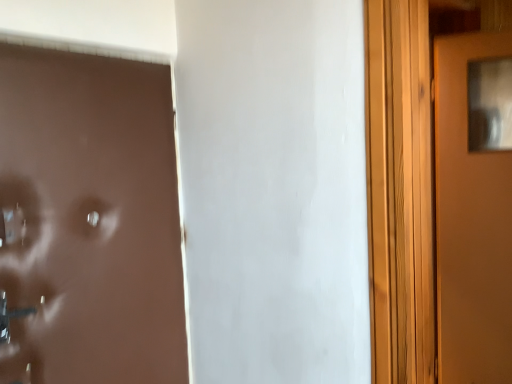
Describe the element at coordinates (471, 222) in the screenshot. The height and width of the screenshot is (384, 512). I see `brown matte door at right, the 2th door viewed from the left` at that location.

Where is `brown matte door at right, the first door when ordered from back to front`? This screenshot has width=512, height=384. brown matte door at right, the first door when ordered from back to front is located at coordinates (471, 222).

This screenshot has height=384, width=512. I want to click on brown matte door at left, the 2th door viewed from the right, so click(90, 220).

Describe the element at coordinates (90, 220) in the screenshot. This screenshot has width=512, height=384. I see `brown matte door at left, the 1th door in the left-to-right sequence` at that location.

Image resolution: width=512 pixels, height=384 pixels. What are the coordinates of `brown matte door at right, the first door when ordered from back to front` in the screenshot? It's located at (471, 222).

Is brown matte door at right, the first door when ordered from back to front, at the right side of brown matte door at left, positioned as the first door in front-to-back order?

Correct, you'll find brown matte door at right, the first door when ordered from back to front, to the right of brown matte door at left, positioned as the first door in front-to-back order.

Is the position of brown matte door at right, the first door when ordered from back to front, less distant than that of brown matte door at left, the 2th door viewed from the right?

That is False.

Is point (506, 208) positioned before point (127, 295)?

No, it is behind (127, 295).

From the image's perspective, is brown matte door at right, the first door when ordered from back to front, positioned above or below brown matte door at left, positioned as the first door in front-to-back order?

brown matte door at right, the first door when ordered from back to front, is above brown matte door at left, positioned as the first door in front-to-back order.

From a real-world perspective, is brown matte door at right, the 2th door viewed from the left, on brown matte door at left, the second door when ordered from back to front?

No, from a real-world perspective, brown matte door at right, the 2th door viewed from the left, is not on top of brown matte door at left, the second door when ordered from back to front.

Is brown matte door at right, the 2th door viewed from the left, wider than brown matte door at left, the 1th door in the left-to-right sequence?

Correct, the width of brown matte door at right, the 2th door viewed from the left, exceeds that of brown matte door at left, the 1th door in the left-to-right sequence.

Is brown matte door at right, the 2th door viewed from the left, taller or shorter than brown matte door at left, positioned as the first door in front-to-back order?

brown matte door at right, the 2th door viewed from the left, is taller than brown matte door at left, positioned as the first door in front-to-back order.

Between brown matte door at right, marked as the 2th door in a front-to-back arrangement, and brown matte door at left, the 1th door in the left-to-right sequence, which one has larger size?

brown matte door at left, the 1th door in the left-to-right sequence.

Which is correct: brown matte door at right, marked as the 2th door in a front-to-back arrangement, is inside brown matte door at left, the second door when ordered from back to front, or outside of it?

brown matte door at right, marked as the 2th door in a front-to-back arrangement, lies outside brown matte door at left, the second door when ordered from back to front.

Is brown matte door at right, which is counted as the first door, starting from the right, not close to brown matte door at left, positioned as the first door in front-to-back order?

Absolutely, brown matte door at right, which is counted as the first door, starting from the right, is distant from brown matte door at left, positioned as the first door in front-to-back order.

Is brown matte door at right, the 2th door viewed from the left, aimed at brown matte door at left, the 1th door in the left-to-right sequence?

No, brown matte door at right, the 2th door viewed from the left, is not turned towards brown matte door at left, the 1th door in the left-to-right sequence.

What are the coordinates of `door located above the brown matte door at right, the first door when ordered from back to front (from a real-world perspective)` in the screenshot? It's located at (90, 220).

Considering the positions of objects brown matte door at left, the 2th door viewed from the right, and brown matte door at right, the first door when ordered from back to front, in the image provided, who is more to the left, brown matte door at left, the 2th door viewed from the right, or brown matte door at right, the first door when ordered from back to front,?

brown matte door at left, the 2th door viewed from the right.

Between brown matte door at left, the 1th door in the left-to-right sequence, and brown matte door at right, the first door when ordered from back to front, which one is positioned in front?

brown matte door at left, the 1th door in the left-to-right sequence.

Does point (167, 101) lie behind point (489, 185)?

No, it is in front of (489, 185).

From the image's perspective, between brown matte door at left, the 2th door viewed from the right, and brown matte door at right, the 2th door viewed from the left, who is located below?

brown matte door at left, the 2th door viewed from the right.

From a real-world perspective, between brown matte door at left, the 1th door in the left-to-right sequence, and brown matte door at right, marked as the 2th door in a front-to-back arrangement, who is vertically lower?

From a 3D spatial view, brown matte door at right, marked as the 2th door in a front-to-back arrangement, is below.

In the scene shown: Does brown matte door at left, positioned as the first door in front-to-back order, have a greater width compared to brown matte door at right, the first door when ordered from back to front?

No, brown matte door at left, positioned as the first door in front-to-back order, is not wider than brown matte door at right, the first door when ordered from back to front.

In the scene shown: Between brown matte door at left, the second door when ordered from back to front, and brown matte door at right, which is counted as the first door, starting from the right, which one has more height?

With more height is brown matte door at right, which is counted as the first door, starting from the right.

From the picture: Can you confirm if brown matte door at left, positioned as the first door in front-to-back order, is smaller than brown matte door at right, marked as the 2th door in a front-to-back arrangement?

Incorrect, brown matte door at left, positioned as the first door in front-to-back order, is not smaller in size than brown matte door at right, marked as the 2th door in a front-to-back arrangement.

Choose the correct answer: Is brown matte door at left, the second door when ordered from back to front, inside brown matte door at right, the first door when ordered from back to front, or outside it?

brown matte door at left, the second door when ordered from back to front, is not inside brown matte door at right, the first door when ordered from back to front, it's outside.

Based on the photo, would you consider brown matte door at left, the second door when ordered from back to front, to be distant from brown matte door at right, which is counted as the first door, starting from the right?

That's right, there is a large distance between brown matte door at left, the second door when ordered from back to front, and brown matte door at right, which is counted as the first door, starting from the right.

Is brown matte door at right, which is counted as the first door, starting from the right, at the back of brown matte door at left, the 1th door in the left-to-right sequence?

No.

How far apart are brown matte door at left, the 1th door in the left-to-right sequence, and brown matte door at right, marked as the 2th door in a front-to-back arrangement?

brown matte door at left, the 1th door in the left-to-right sequence, is 1.59 meters away from brown matte door at right, marked as the 2th door in a front-to-back arrangement.

At what (x,y) coordinates should I click in order to perform the action: click on door on the right of brown matte door at left, the 1th door in the left-to-right sequence. Please return your answer as a coordinate pair (x, y). Image resolution: width=512 pixels, height=384 pixels. Looking at the image, I should click on (471, 222).

Locate an element on the screen. Image resolution: width=512 pixels, height=384 pixels. door on the right of the brown matte door at left, positioned as the first door in front-to-back order is located at coordinates (471, 222).

Image resolution: width=512 pixels, height=384 pixels. Identify the location of door on the left of brown matte door at right, marked as the 2th door in a front-to-back arrangement. (90, 220).